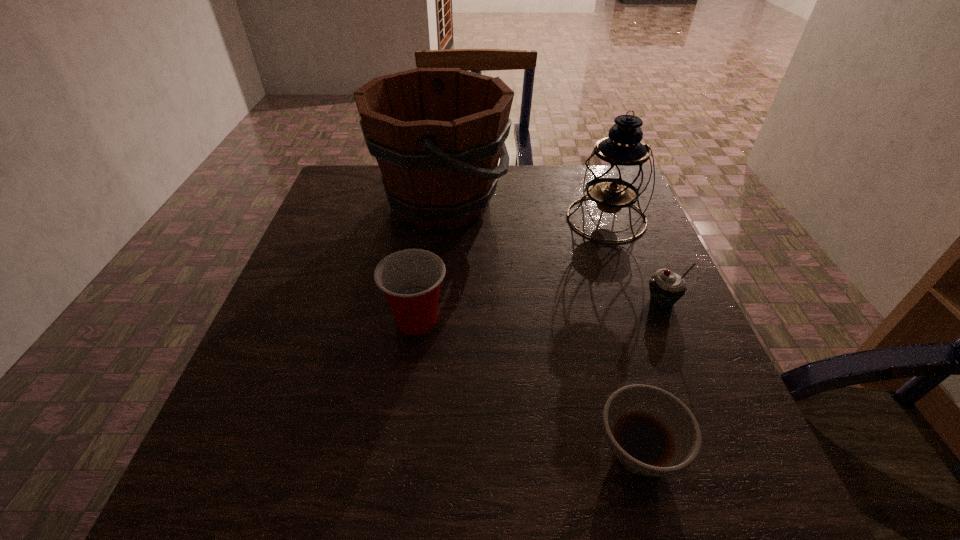
Where is `vacant area located 0.370m on the back of the shortest object`? The image size is (960, 540). vacant area located 0.370m on the back of the shortest object is located at coordinates (589, 270).

Identify the location of bucket present at the far edge. (437, 134).

Locate an element on the screen. Image resolution: width=960 pixels, height=540 pixels. lantern situated at the far edge is located at coordinates (618, 171).

You are a GUI agent. You are given a task and a screenshot of the screen. Output one action in this format:
    pyautogui.click(x=<x>, y=<y>)
    Task: Click on the object that is at the near edge
    
    Given the screenshot: What is the action you would take?
    pyautogui.click(x=651, y=432)

The height and width of the screenshot is (540, 960). In order to click on object at the left edge in this screenshot , I will do `click(437, 134)`.

Find the location of a particular element. lantern positioned at the right edge is located at coordinates (618, 171).

Find the location of a particular element. cupcake that is at the right edge is located at coordinates (666, 288).

Where is `soup bowl situated at the right edge`? The width and height of the screenshot is (960, 540). soup bowl situated at the right edge is located at coordinates (651, 432).

Locate an element on the screen. The width and height of the screenshot is (960, 540). object located in the far left corner section of the desktop is located at coordinates (437, 134).

Where is `object at the far right corner`? The image size is (960, 540). object at the far right corner is located at coordinates (618, 171).